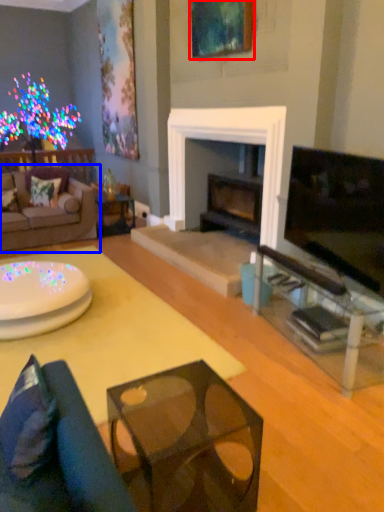
Question: Which point is further to the camera, picture frame (highlighted by a red box) or studio couch (highlighted by a blue box)?

Choices:
 (A) picture frame
 (B) studio couch

Answer: (B)